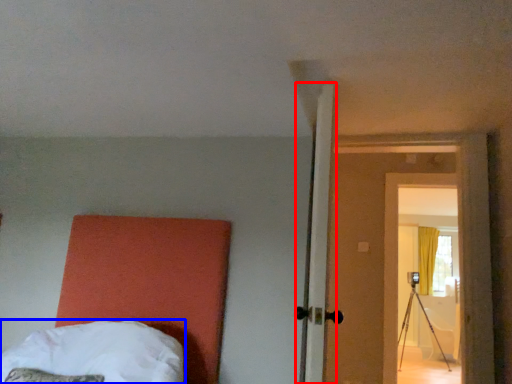
Question: Which of the following is the farthest to the observer, door (highlighted by a red box) or bed (highlighted by a blue box)?

Choices:
 (A) door
 (B) bed

Answer: (A)